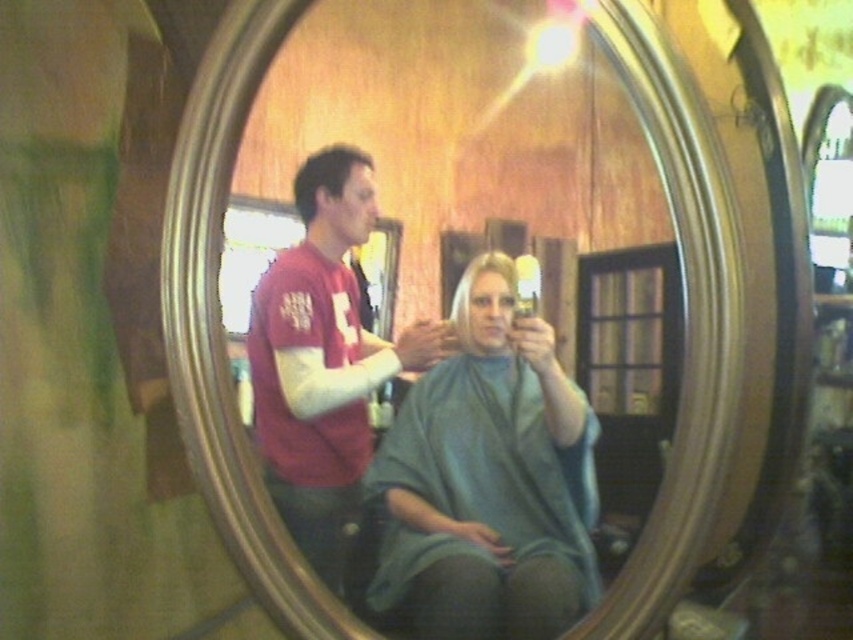
Is point (216, 492) closer to viewer compared to point (515, 440)?

No, (216, 492) is further to viewer.

Is silver metallic mirror at center behind green fabric cape at center?

Yes, it is.

Is point (653, 33) positioned in front of point (395, 436)?

Yes, point (653, 33) is in front of point (395, 436).

I want to click on silver metallic mirror at center, so click(218, 324).

Does dark brown hair at center appear on the left side of blonde hair at center?

Indeed, dark brown hair at center is positioned on the left side of blonde hair at center.

Is dark brown hair at center in front of blonde hair at center?

That is False.

You are a GUI agent. You are given a task and a screenshot of the screen. Output one action in this format:
    pyautogui.click(x=<x>, y=<y>)
    Task: Click on the dark brown hair at center
    The image size is (853, 640).
    Given the screenshot: What is the action you would take?
    pyautogui.click(x=323, y=177)

Is matte red shirt at center positioned behind dark brown hair at center?

No, it is not.

Which is behind, point (292, 378) or point (318, 161)?

The point (292, 378) is more distant.

Does point (274, 432) come in front of point (309, 200)?

No, (274, 432) is further to viewer.

Locate an element on the screen. Image resolution: width=853 pixels, height=640 pixels. matte red shirt at center is located at coordinates (323, 358).